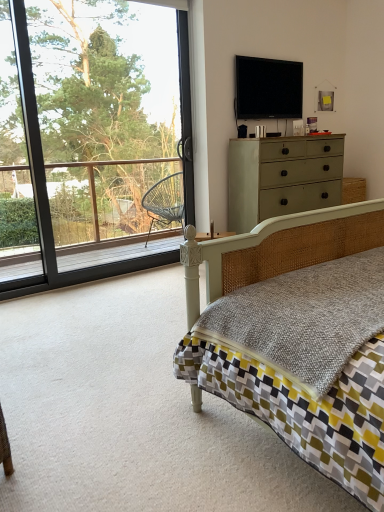
Question: Is matte green dresser at upper right aimed at flat screen tv at upper center?

Choices:
 (A) yes
 (B) no

Answer: (B)

Question: Is matte green dresser at upper right outside flat screen tv at upper center?

Choices:
 (A) no
 (B) yes

Answer: (B)

Question: Is flat screen tv at upper center surrounded by matte green dresser at upper right?

Choices:
 (A) no
 (B) yes

Answer: (A)

Question: Is matte green dresser at upper right placed right next to flat screen tv at upper center?

Choices:
 (A) yes
 (B) no

Answer: (B)

Question: From the image's perspective, would you say matte green dresser at upper right is positioned over flat screen tv at upper center?

Choices:
 (A) yes
 (B) no

Answer: (B)

Question: Does matte green dresser at upper right have a greater height compared to flat screen tv at upper center?

Choices:
 (A) no
 (B) yes

Answer: (B)

Question: Is matte wicker bed at center at the right side of transparent glass window at upper left?

Choices:
 (A) no
 (B) yes

Answer: (B)

Question: Is matte wicker bed at center directly adjacent to transparent glass window at upper left?

Choices:
 (A) no
 (B) yes

Answer: (A)

Question: From a real-world perspective, is matte wicker bed at center on top of transparent glass window at upper left?

Choices:
 (A) no
 (B) yes

Answer: (A)

Question: From the image's perspective, would you say matte wicker bed at center is shown under transparent glass window at upper left?

Choices:
 (A) yes
 (B) no

Answer: (A)

Question: From the image's perspective, is matte wicker bed at center on transparent glass window at upper left?

Choices:
 (A) no
 (B) yes

Answer: (A)

Question: Considering the relative positions of matte wicker bed at center and transparent glass window at upper left in the image provided, is matte wicker bed at center to the left of transparent glass window at upper left from the viewer's perspective?

Choices:
 (A) no
 (B) yes

Answer: (A)

Question: Is flat screen tv at upper center further to camera compared to matte green dresser at upper right?

Choices:
 (A) no
 (B) yes

Answer: (B)